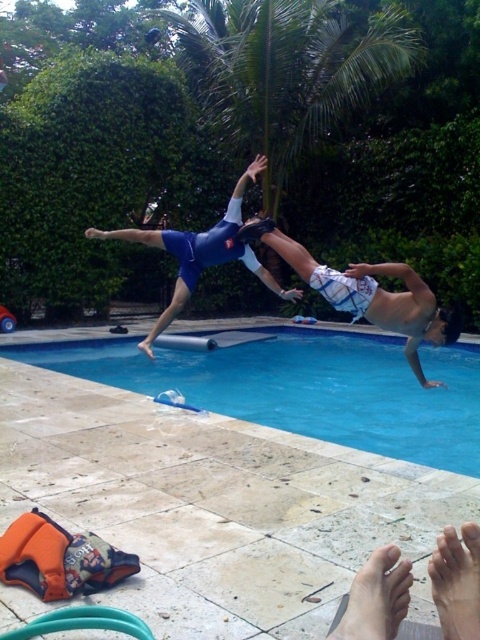
Looking at this image, you are a lifeguard on duty at the pool. You notice two objects in the pool area. One is the blue smooth water at center and the other is the white cotton shorts at center. You need to retrieve an object that is closer to you. Which one should you choose?

The blue smooth water at center is 1.95 meters from the white cotton shorts at center. Since you are a lifeguard on duty, you would prioritize retrieving the object closer to you. However, the question does not specify your exact position relative to the objects. Assuming you are positioned near the pool deck, the white cotton shorts at center might be closer as they are on the deck, while the water is in the pool. But based solely on the given distance between the two objects, if you are equidistant from,

You are a photographer at the edge of the pool. You want to capture a photo where the blue matte swimsuit at center is visible in front of the blue smooth water at center. Is this possible based on their current positions?

The blue matte swimsuit at center is behind the blue smooth water at center, so it cannot be seen in front of it in the current positions.